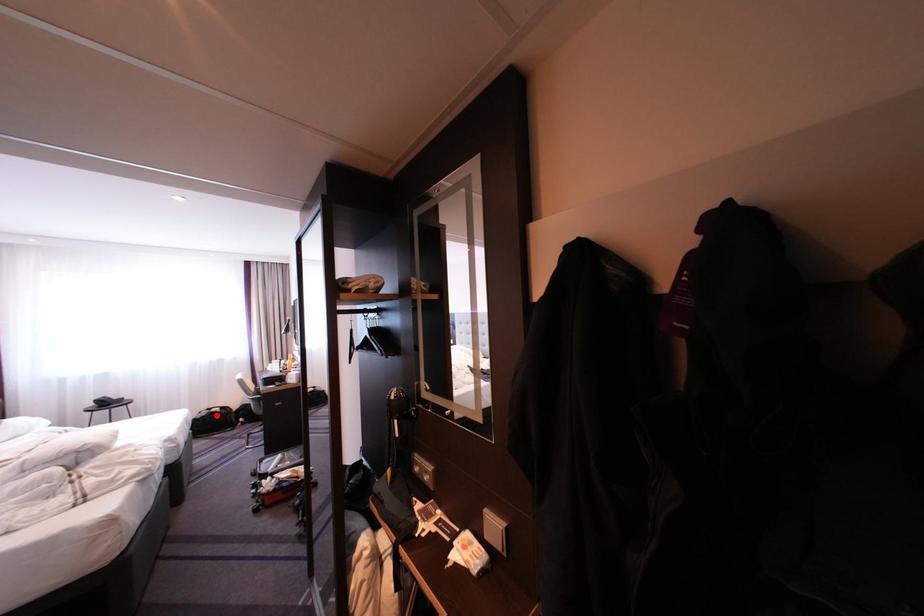
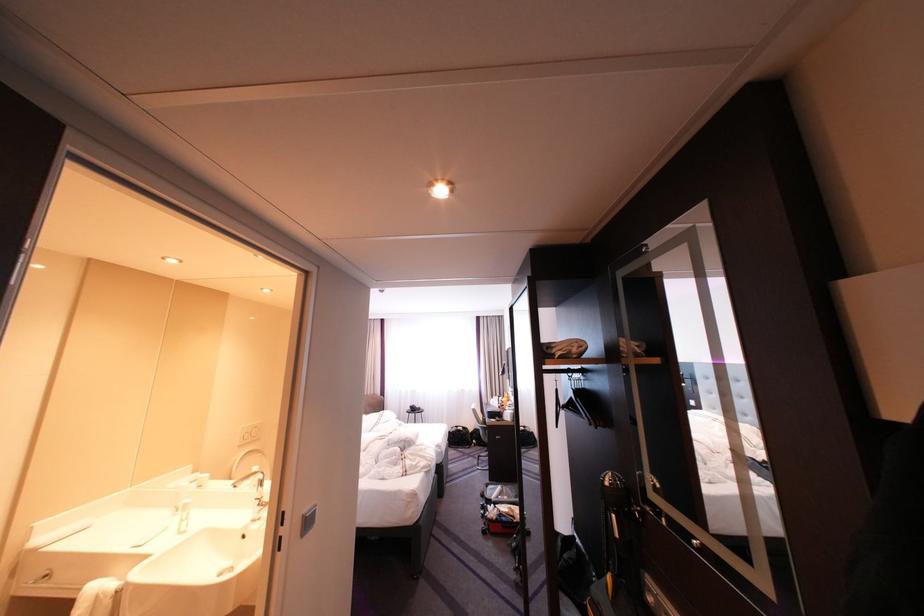
Locate, in the second image, the point that corresponds to the highlighted location in the first image.

(467, 431)